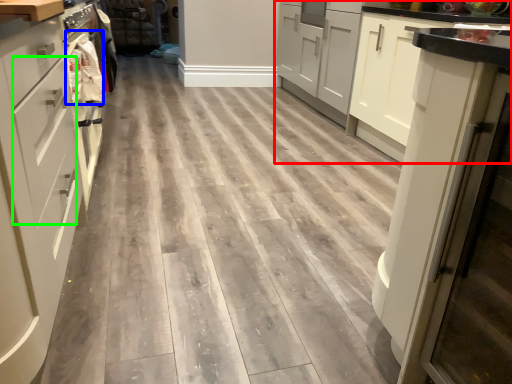
Question: Considering the real-world distances, which object is farthest from cabinetry (highlighted by a red box)? material (highlighted by a blue box) or drawer (highlighted by a green box)?

Choices:
 (A) material
 (B) drawer

Answer: (B)